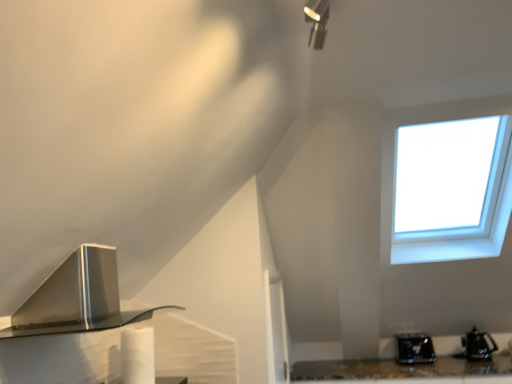
Question: Choose the correct answer: Is black plastic kettle at lower right, placed as the 1th appliance when sorted from right to left, inside shiny black toaster at lower right, which is the 2th appliance from right to left, or outside it?

Choices:
 (A) outside
 (B) inside

Answer: (A)

Question: From their relative heights in the image, would you say black plastic kettle at lower right, marked as the 2th appliance in a left-to-right arrangement, is taller or shorter than shiny black toaster at lower right, which is the 2th appliance from right to left?

Choices:
 (A) short
 (B) tall

Answer: (A)

Question: Considering the real-world distances, which object is closest to the shiny black toaster at lower right, the first appliance positioned from the left?

Choices:
 (A) satin silver range hood at lower left
 (B) black plastic kettle at lower right, placed as the 1th appliance when sorted from right to left

Answer: (B)

Question: Which object is positioned closest to the shiny black toaster at lower right, the first appliance positioned from the left?

Choices:
 (A) satin silver range hood at lower left
 (B) black plastic kettle at lower right, placed as the 1th appliance when sorted from right to left

Answer: (B)